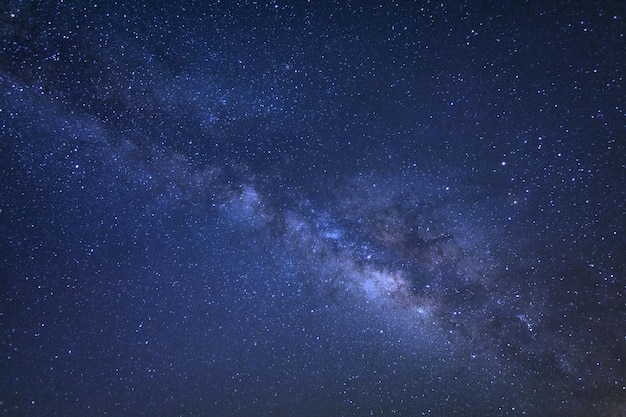
I want to click on light area, so click(382, 283), click(397, 286).